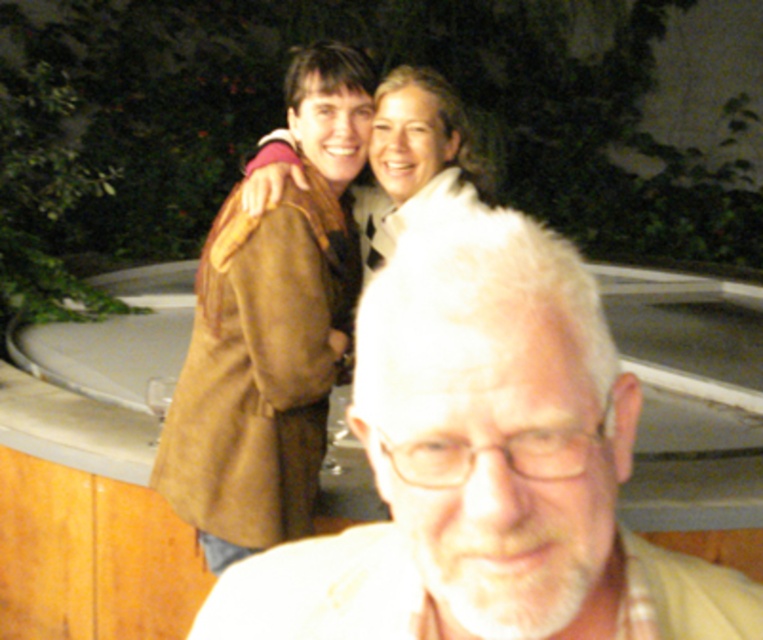
Question: Considering the real-world distances, which object is farthest from the white matte hair at center?

Choices:
 (A) brown suede coat at upper center
 (B) white fur coat at upper center

Answer: (B)

Question: Observing the image, what is the correct spatial positioning of white matte hair at center in reference to brown suede coat at upper center?

Choices:
 (A) right
 (B) left

Answer: (A)

Question: Which point appears farthest from the camera in this image?

Choices:
 (A) (459, 333)
 (B) (266, 202)

Answer: (B)

Question: Is brown suede coat at upper center positioned before white fur coat at upper center?

Choices:
 (A) yes
 (B) no

Answer: (A)

Question: Does brown suede coat at upper center appear over white fur coat at upper center?

Choices:
 (A) no
 (B) yes

Answer: (A)

Question: Which of the following is the closest to the observer?

Choices:
 (A) (291, 301)
 (B) (407, 192)

Answer: (A)